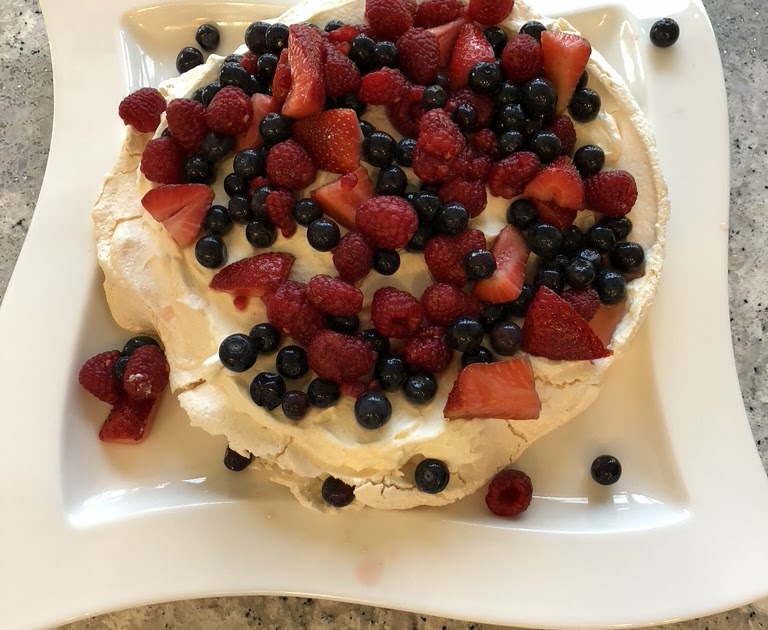
Where is `white plate`? The height and width of the screenshot is (630, 768). white plate is located at coordinates (521, 600).